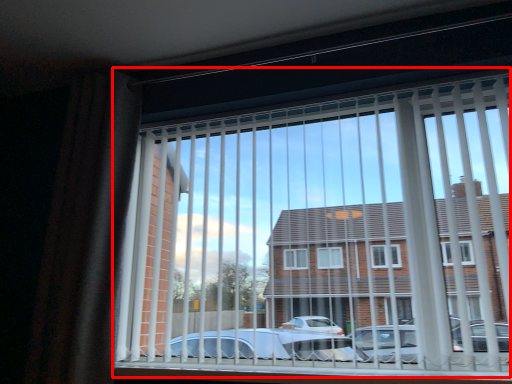
Question: From the image's perspective, where is window (annotated by the red box) located relative to curtain?

Choices:
 (A) below
 (B) above

Answer: (A)